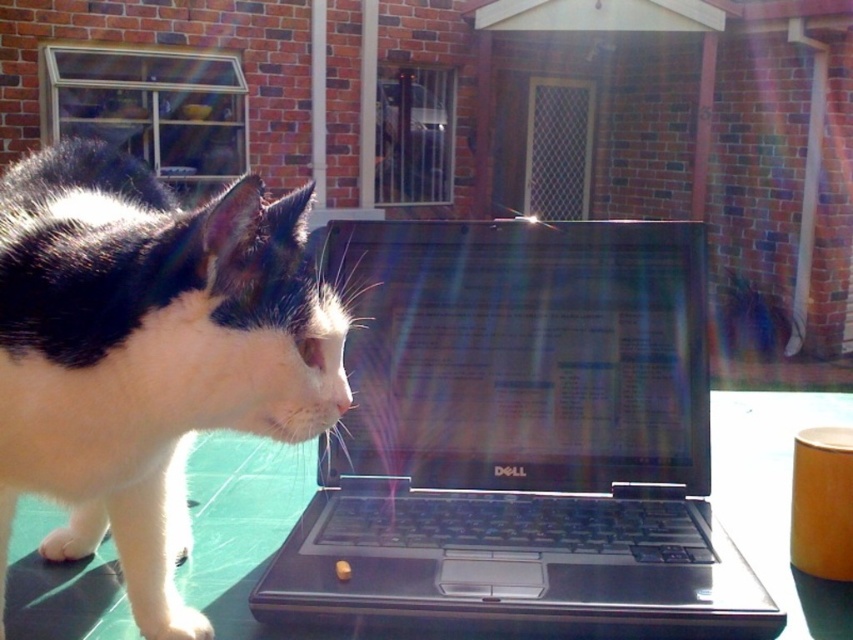
Who is lower down, black plastic laptop at center or black and white fur cat at left?

black plastic laptop at center is lower down.

Identify the location of black plastic laptop at center. (520, 438).

Which is above, black plastic laptop at center or green glossy table at center?

Positioned higher is black plastic laptop at center.

Can you confirm if black plastic laptop at center is smaller than green glossy table at center?

Indeed, black plastic laptop at center has a smaller size compared to green glossy table at center.

Describe the element at coordinates (520, 438) in the screenshot. I see `black plastic laptop at center` at that location.

At what (x,y) coordinates should I click in order to perform the action: click on black plastic laptop at center. Please return your answer as a coordinate pair (x, y). This screenshot has height=640, width=853. Looking at the image, I should click on (520, 438).

In the scene shown: Can you confirm if black and white fur cat at left is wider than green glossy table at center?

No, black and white fur cat at left is not wider than green glossy table at center.

This screenshot has width=853, height=640. What do you see at coordinates (148, 353) in the screenshot?
I see `black and white fur cat at left` at bounding box center [148, 353].

Find the location of a particular element. This screenshot has height=640, width=853. black and white fur cat at left is located at coordinates click(148, 353).